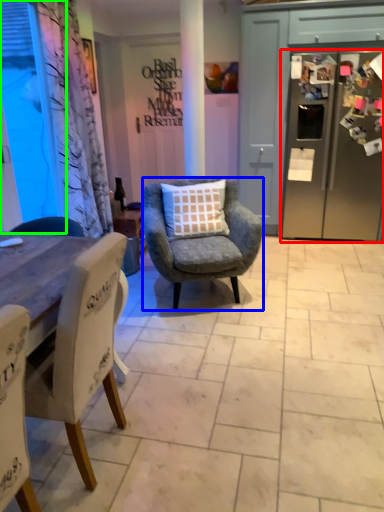
Question: Which object is the farthest from refrigerator (highlighted by a red box)? Choose among these: chair (highlighted by a blue box) or window screen (highlighted by a green box).

Choices:
 (A) chair
 (B) window screen

Answer: (B)